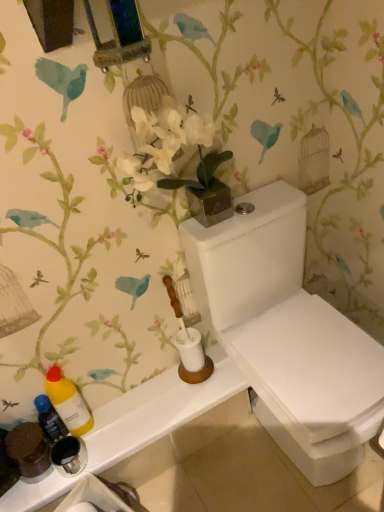
The height and width of the screenshot is (512, 384). I want to click on free space above white glossy counter top at lower left (from a real-world perspective), so click(129, 418).